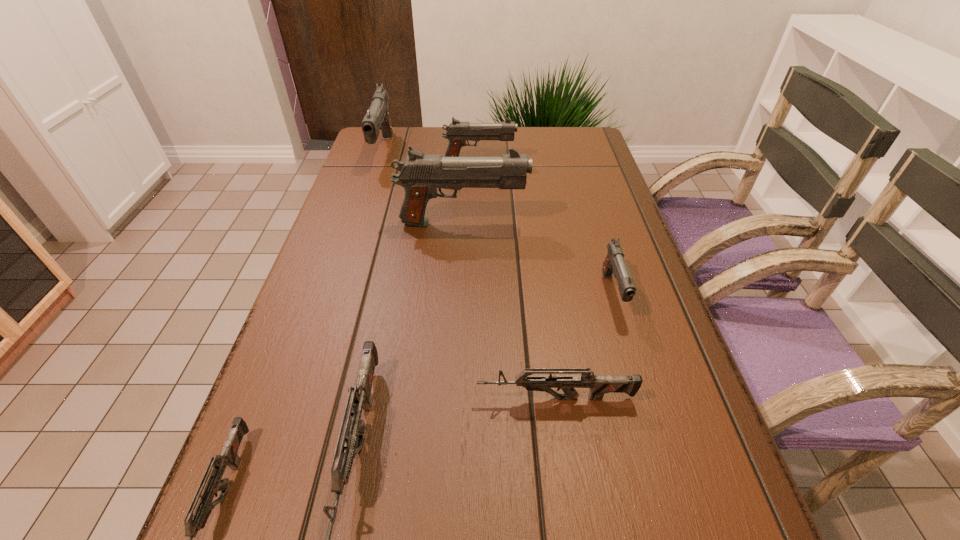
The width and height of the screenshot is (960, 540). I want to click on the biggest gray gun, so click(420, 175).

Locate an element on the screen. This screenshot has height=540, width=960. the fifth nearest gun is located at coordinates (420, 175).

Where is `the second biggest gray gun`? This screenshot has height=540, width=960. the second biggest gray gun is located at coordinates (377, 118).

In order to click on the sixth gun from right to left in this screenshot , I will do `click(377, 118)`.

Locate an element on the screen. The width and height of the screenshot is (960, 540). the third tallest gun is located at coordinates (458, 132).

Where is `the second smallest gray gun`? Image resolution: width=960 pixels, height=540 pixels. the second smallest gray gun is located at coordinates (458, 132).

Where is `the smallest gray gun`? This screenshot has width=960, height=540. the smallest gray gun is located at coordinates (614, 263).

Where is `the rightmost gray gun`? the rightmost gray gun is located at coordinates click(x=614, y=263).

Find the location of a particular element. The width and height of the screenshot is (960, 540). the rightmost grey gun is located at coordinates (599, 385).

Find the location of a particular element. The width and height of the screenshot is (960, 540). the second biggest grey gun is located at coordinates (599, 385).